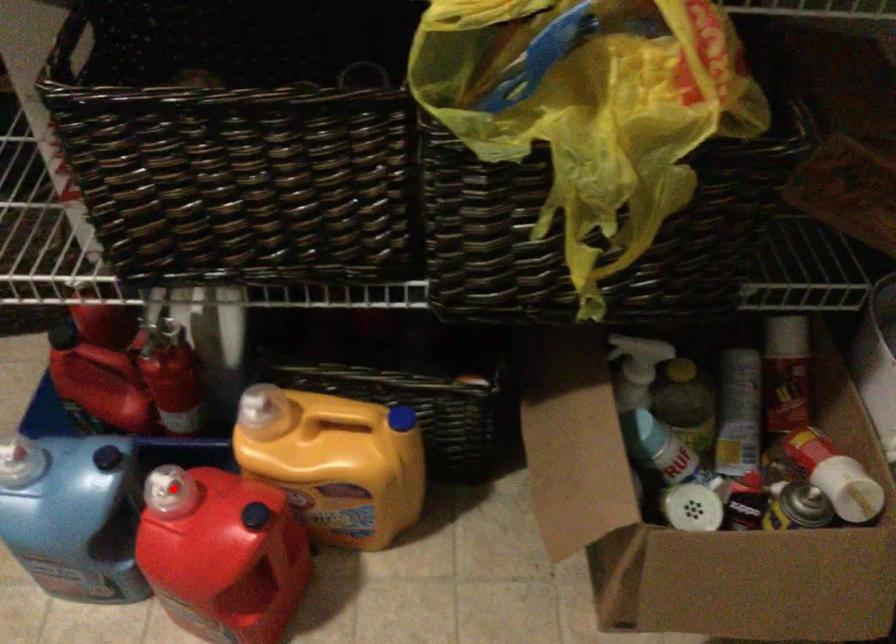
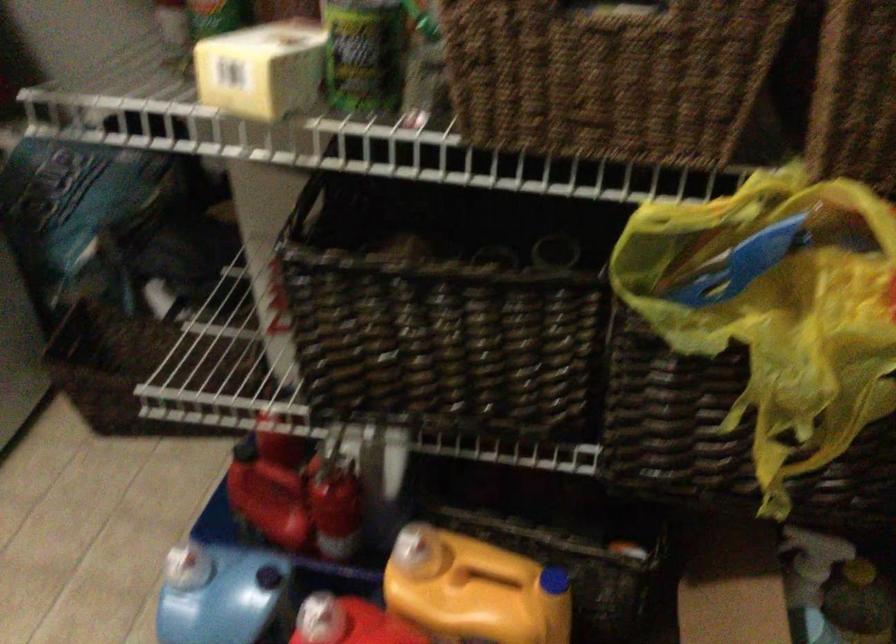
Find the pixel in the second image that matches the highlighted location in the first image.

(320, 619)